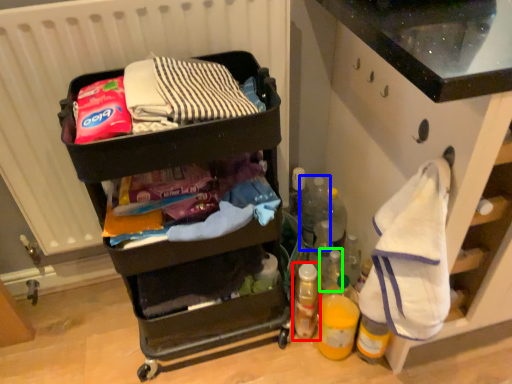
Question: Estimate the real-world distances between objects in this image. Which object is closer to bottle (highlighted by a red box), bottle (highlighted by a blue box) or bottle (highlighted by a green box)?

Choices:
 (A) bottle
 (B) bottle

Answer: (B)